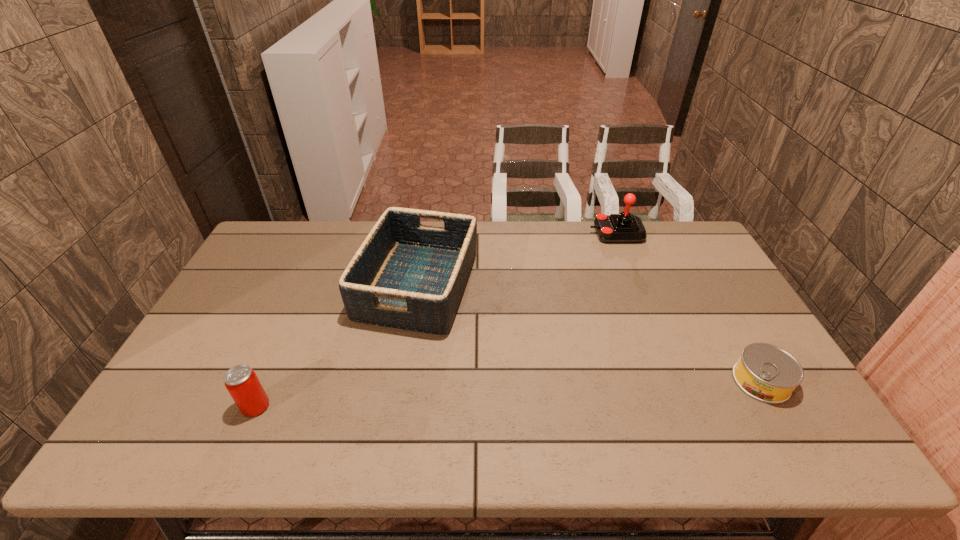
Locate an element on the screen. The height and width of the screenshot is (540, 960). vacant space located 0.250m on the back of the taller can is located at coordinates (293, 321).

The height and width of the screenshot is (540, 960). Identify the location of free space located 0.270m on the back of the shortest object. (709, 291).

The image size is (960, 540). Identify the location of joystick located at the far edge. tap(615, 228).

This screenshot has width=960, height=540. Identify the location of basket that is at the far edge. (405, 275).

This screenshot has width=960, height=540. Find the location of `object at the right edge`. object at the right edge is located at coordinates (767, 373).

Image resolution: width=960 pixels, height=540 pixels. In the image, there is a desktop. In order to click on vacant space at the far edge in this screenshot , I will do `click(495, 224)`.

Where is `vacant space at the near edge`? This screenshot has width=960, height=540. vacant space at the near edge is located at coordinates (290, 436).

The image size is (960, 540). Find the location of `vacant space at the left edge`. vacant space at the left edge is located at coordinates (251, 349).

Identify the location of free region at the right edge of the desktop. The height and width of the screenshot is (540, 960). (749, 325).

You are a GUI agent. You are given a task and a screenshot of the screen. Output one action in this format:
    pyautogui.click(x=<x>, y=<y>)
    Task: Click on the vacant space at the near left corner of the desktop
    The image size is (960, 540).
    Given the screenshot: What is the action you would take?
    pyautogui.click(x=194, y=430)